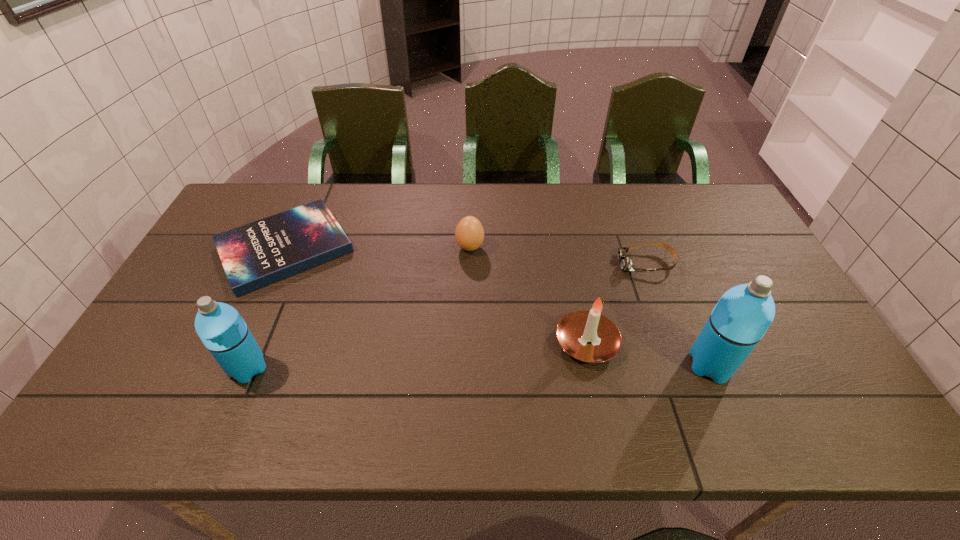
Identify the location of the second tallest object. (222, 330).

Where is `the shorter thermos bottle`? Image resolution: width=960 pixels, height=540 pixels. the shorter thermos bottle is located at coordinates (222, 330).

At what (x,y) coordinates should I click in order to perform the action: click on the tallest object. Please return your answer as a coordinate pair (x, y). This screenshot has width=960, height=540. Looking at the image, I should click on (743, 314).

Find the location of `the right thermos bottle`. the right thermos bottle is located at coordinates (743, 314).

Find the location of a particular element. goggles is located at coordinates (626, 264).

Locate an element on the screen. the third object from left to right is located at coordinates (469, 233).

Locate an element on the screen. This screenshot has height=540, width=960. the third shortest object is located at coordinates (469, 233).

At what (x,y) coordinates should I click in order to perform the action: click on hardback book. Please return your answer as a coordinate pair (x, y). Image resolution: width=960 pixels, height=540 pixels. Looking at the image, I should click on (x=254, y=255).

Where is `candle`? candle is located at coordinates (588, 336).

You are a GUI agent. You are given a task and a screenshot of the screen. Output one action in this format:
    pyautogui.click(x=<x>, y=<y>)
    Task: Click on the fourth shortest object
    This screenshot has width=960, height=540.
    Given the screenshot: What is the action you would take?
    pyautogui.click(x=588, y=336)